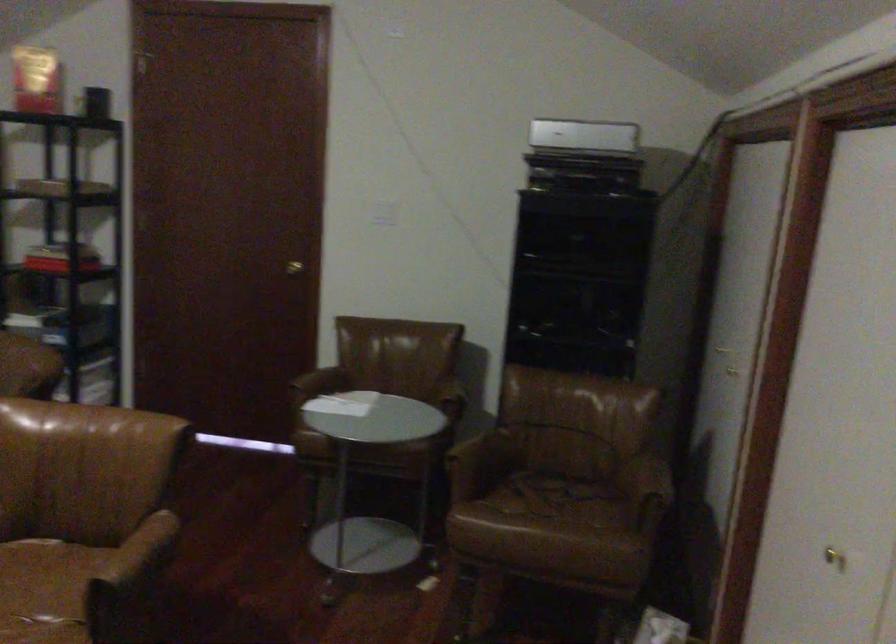
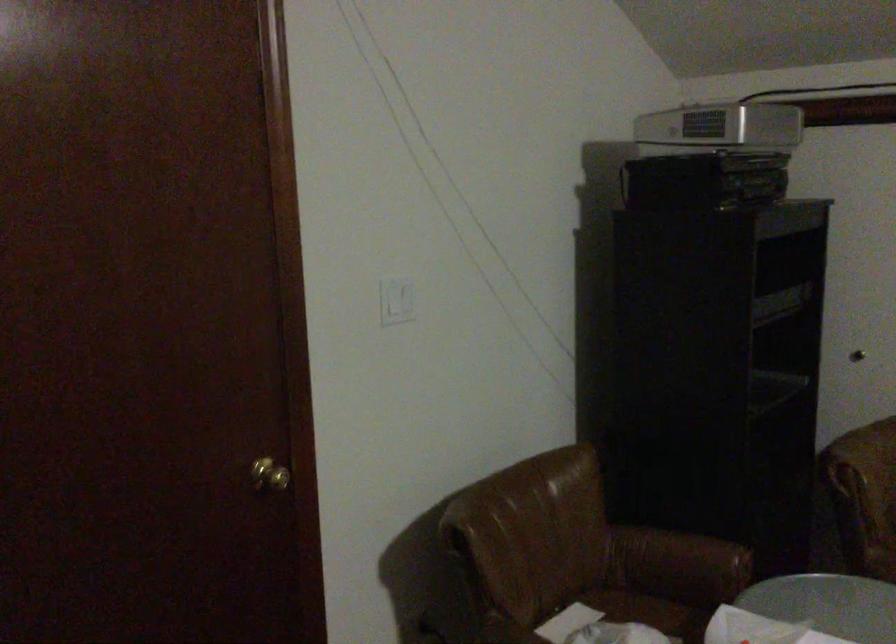
The point at (444, 397) is marked in the first image. Where is the corresponding point in the second image?

(679, 559)